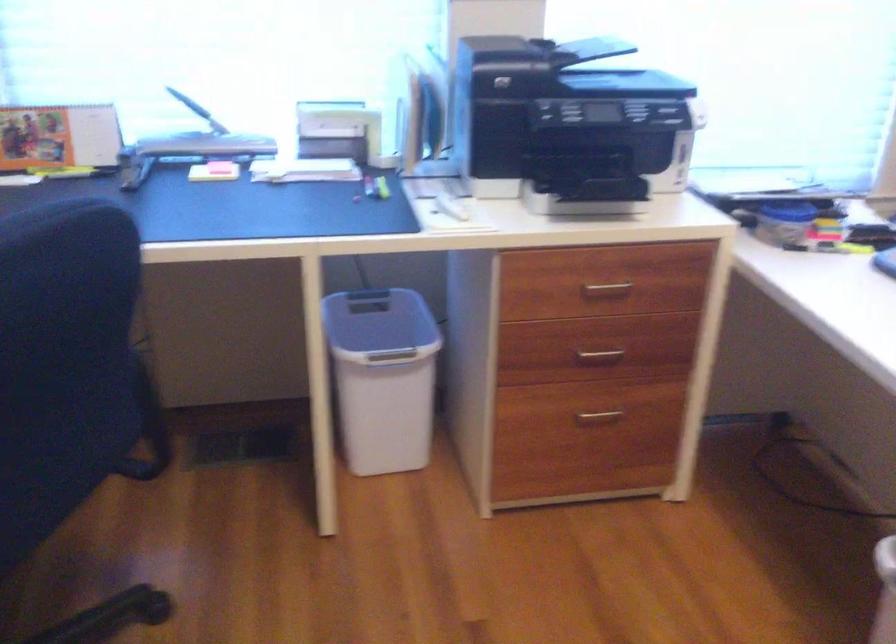
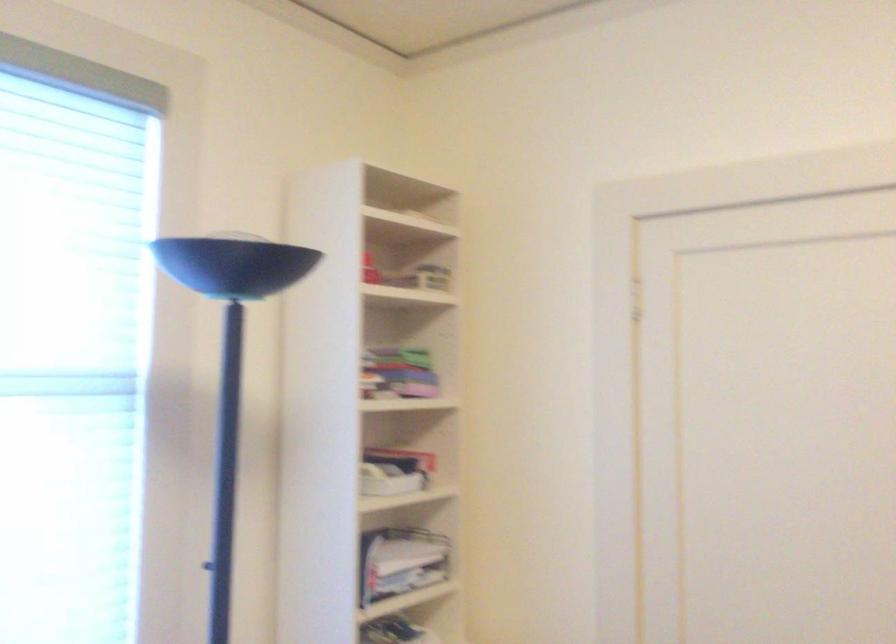
How did the camera likely rotate?

The camera's rotation is toward right-up.